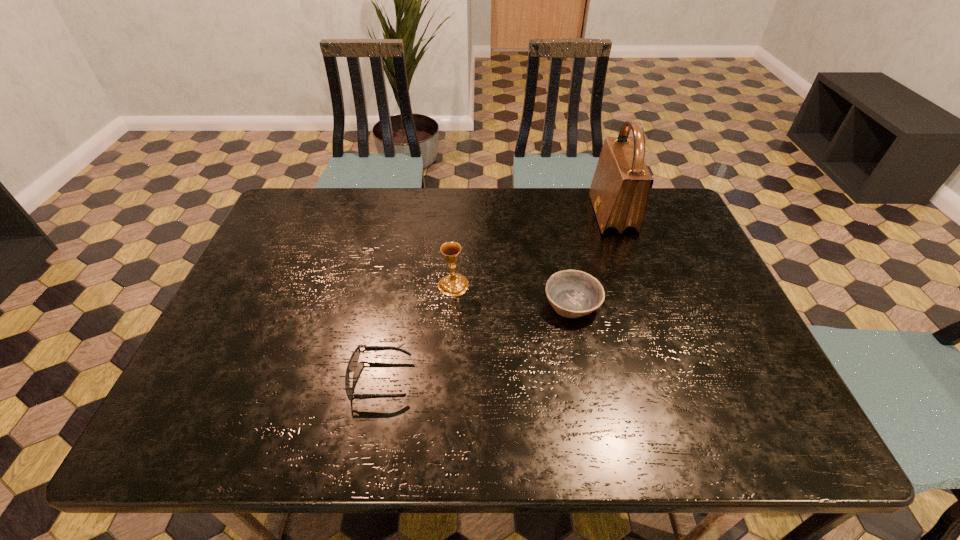
This screenshot has height=540, width=960. I want to click on vacant space situated on the left of the third object from right to left, so click(332, 285).

I want to click on free region located 0.310m on the back of the third object from left to right, so click(554, 213).

I want to click on vacant space situated on the front-facing side of the nearest object, so click(570, 380).

Image resolution: width=960 pixels, height=540 pixels. Find the location of `object at the far edge`. object at the far edge is located at coordinates (619, 191).

The width and height of the screenshot is (960, 540). In order to click on object at the right edge in this screenshot , I will do pyautogui.click(x=619, y=191).

Find the location of `object that is at the far right corner`. object that is at the far right corner is located at coordinates pyautogui.click(x=619, y=191).

Locate an element on the screen. The width and height of the screenshot is (960, 540). vacant space at the far edge of the desktop is located at coordinates (497, 198).

Locate an element on the screen. Image resolution: width=960 pixels, height=540 pixels. free space at the near edge is located at coordinates (391, 413).

Locate an element on the screen. free space at the left edge is located at coordinates (274, 341).

At what (x,y) coordinates should I click in order to perform the action: click on vacant area at the right edge of the desktop. Please return your answer as a coordinate pair (x, y). This screenshot has width=960, height=540. Looking at the image, I should click on (687, 274).